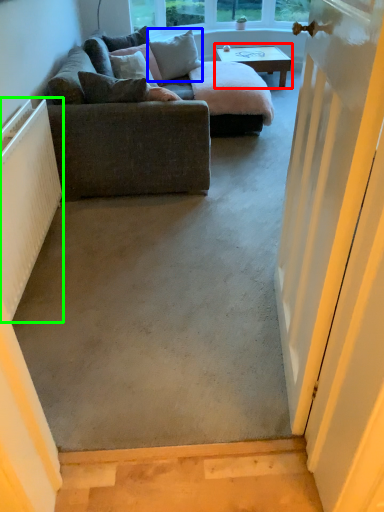
Question: Which object is the farthest from coffee table (highlighted by a red box)? Choose among these: pillow (highlighted by a blue box) or radiator (highlighted by a green box).

Choices:
 (A) pillow
 (B) radiator

Answer: (B)